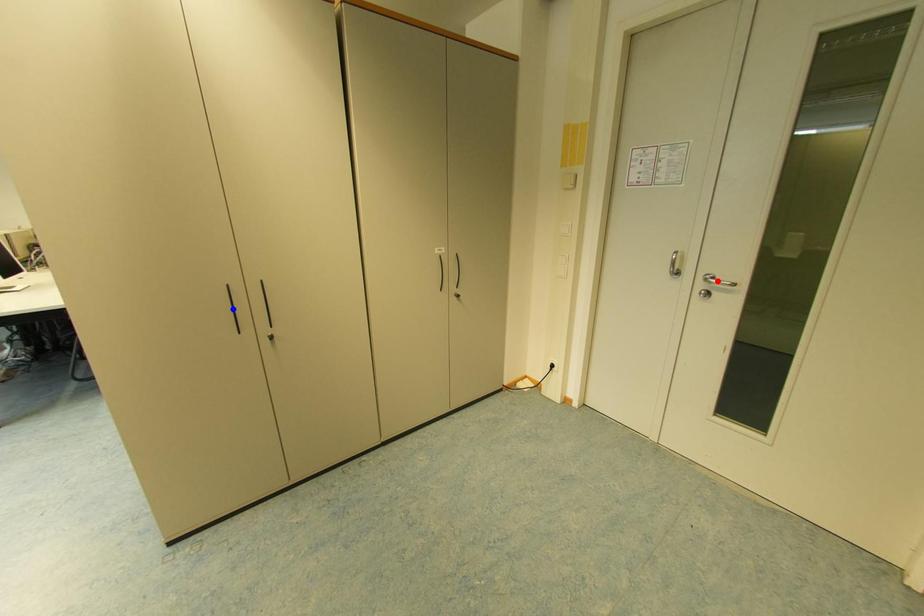
Question: In the image, two points are highlighted. Which point is nearer to the camera? Reply with the corresponding letter.

Choices:
 (A) blue point
 (B) red point

Answer: (A)